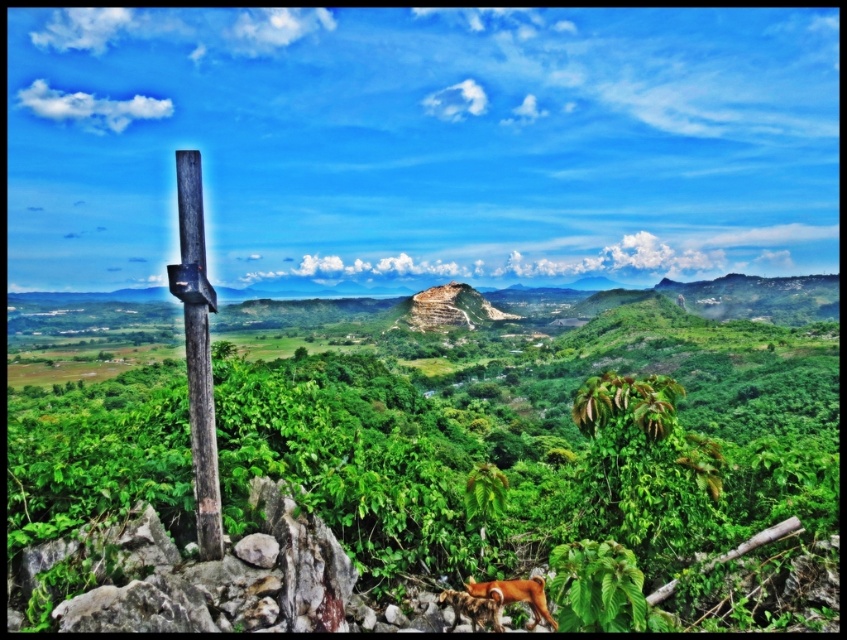
Question: Does brown wooden pole at left appear on the left side of brown fur dog at lower right?

Choices:
 (A) no
 (B) yes

Answer: (B)

Question: Does brown wooden pole at left have a larger size compared to brown furry dog at lower right?

Choices:
 (A) yes
 (B) no

Answer: (A)

Question: Which point is closer to the camera?

Choices:
 (A) (500, 595)
 (B) (195, 150)
 (C) (537, 595)

Answer: (A)

Question: Which point appears farthest from the camera in this image?

Choices:
 (A) (526, 588)
 (B) (181, 200)
 (C) (562, 541)
 (D) (458, 598)

Answer: (C)

Question: Which of these objects is positioned farthest from the brown wooden pole at left?

Choices:
 (A) brown furry dog at lower right
 (B) brown fur dog at lower right

Answer: (B)

Question: Is green leafy vegetation at center closer to camera compared to brown furry dog at lower right?

Choices:
 (A) no
 (B) yes

Answer: (B)